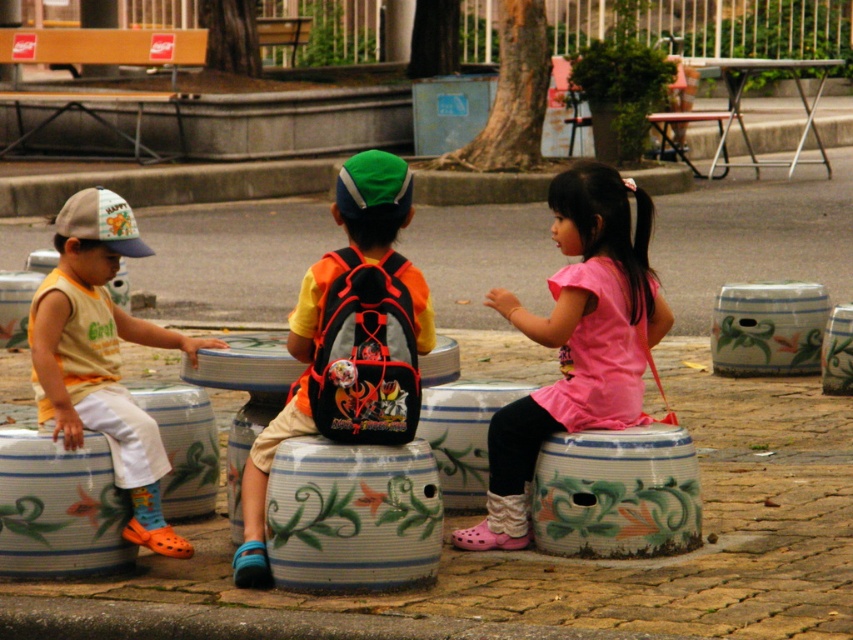
Can you confirm if matte orange backpack at center is smaller than pink fabric dress at center?

Incorrect, matte orange backpack at center is not smaller in size than pink fabric dress at center.

Who is shorter, matte orange backpack at center or pink fabric dress at center?

With less height is pink fabric dress at center.

The width and height of the screenshot is (853, 640). Identify the location of matte orange backpack at center. (347, 340).

Is matte orange backpack at center shorter than matte yellow tank top at left?

Incorrect, matte orange backpack at center's height does not fall short of matte yellow tank top at left's.

Can you confirm if matte orange backpack at center is positioned above matte yellow tank top at left?

Yes, matte orange backpack at center is above matte yellow tank top at left.

Is point (386, 337) closer to viewer compared to point (67, 253)?

Yes, it is.

Where is `matte orange backpack at center`? Image resolution: width=853 pixels, height=640 pixels. matte orange backpack at center is located at coordinates (347, 340).

Which is behind, point (595, 212) or point (38, 333)?

The point (595, 212) is more distant.

Is pink fabric dress at center wider than matte yellow tank top at left?

Correct, the width of pink fabric dress at center exceeds that of matte yellow tank top at left.

The height and width of the screenshot is (640, 853). Identify the location of pink fabric dress at center. (576, 340).